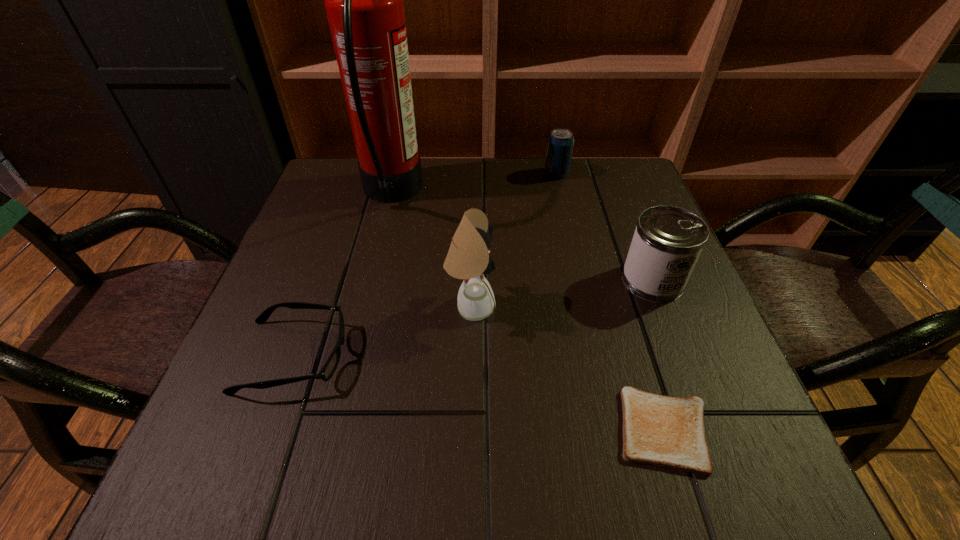
Where is `vacant area in the image that satisfies the following two spatial constraints: 1. at the front face of the toast; 2. on the left side of the third object from left to right`? The height and width of the screenshot is (540, 960). vacant area in the image that satisfies the following two spatial constraints: 1. at the front face of the toast; 2. on the left side of the third object from left to right is located at coordinates (468, 430).

Find the location of a particular element. vacant space that satisfies the following two spatial constraints: 1. on the front-facing side of the shortest object; 2. on the right side of the fire extinguisher is located at coordinates (333, 430).

What are the coordinates of `free point that satisfies the following two spatial constraints: 1. on the front-facing side of the tallest object; 2. on the back side of the third tallest object` in the screenshot? It's located at (370, 281).